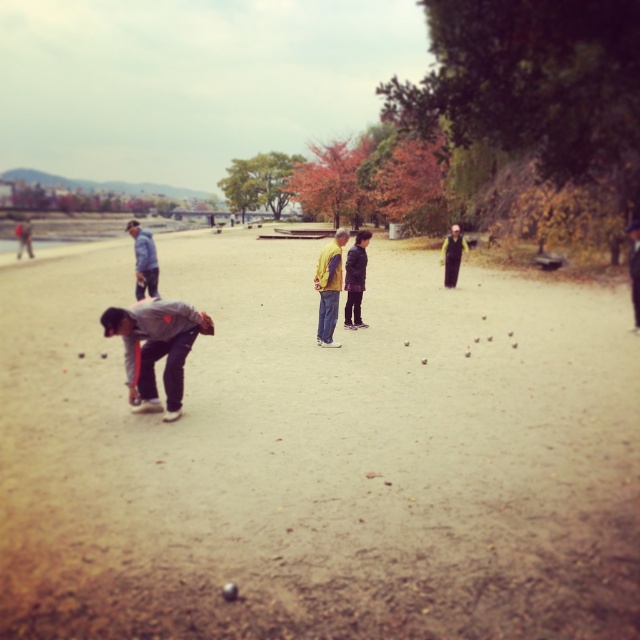
You are standing at the center of the image. Which direction should you move to find the gray fabric jacket at lower left?

You should move to the lower left direction to find the gray fabric jacket at lower left as it is located at point (x=156, y=348).

You are standing at the point labeled point (634, 296) and want to walk to the point labeled point (125, 445). Given the scene described, will you pass by the person picking up the metallic ball along the way?

Yes, because point (125, 445) is in front of point (634, 296), so walking from point (634, 296) to point (125, 445) would require moving towards the foreground where the person is picking up the metallic ball, likely passing by them.

You are standing in the park near the bridge and want to retrieve the metallic ball located at point (460, 228). Given that the ball is 18.75 meters away from you, can you reach it without moving more than 15 meters?

The metallic ball at point (460, 228) is 18.75 meters away from you. Since 18.75 meters exceeds the 15 meters limit, you cannot reach it without moving more than 15 meters.